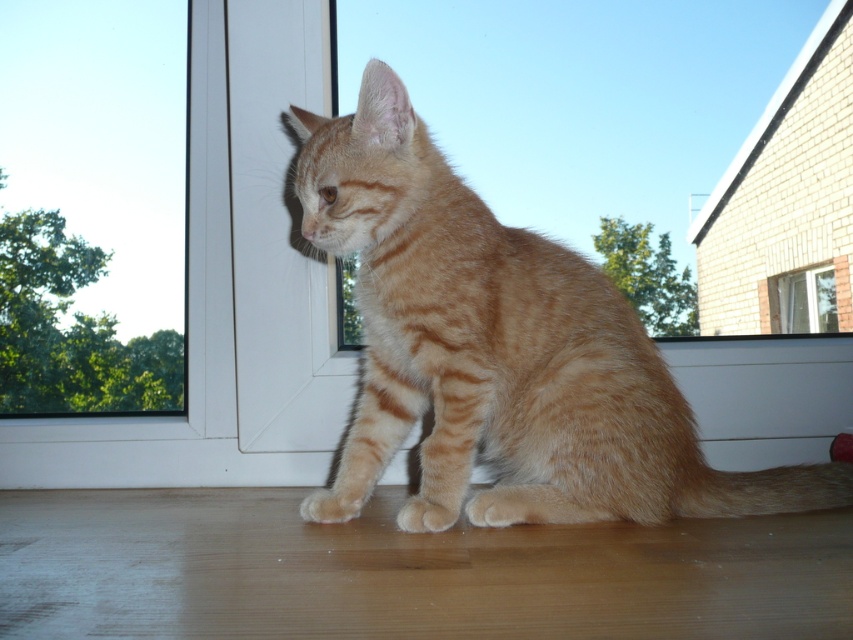
Question: Is orange tabby cat at center thinner than transparent glass window at upper left?

Choices:
 (A) no
 (B) yes

Answer: (A)

Question: Which object appears closest to the camera in this image?

Choices:
 (A) transparent glass window at upper left
 (B) transparent glass window at upper right

Answer: (A)

Question: Which object is farther from the camera taking this photo?

Choices:
 (A) orange tabby cat at center
 (B) transparent glass window at upper left

Answer: (B)

Question: Can you confirm if orange tabby cat at center is positioned to the right of transparent glass window at upper right?

Choices:
 (A) yes
 (B) no

Answer: (B)

Question: In this image, where is orange tabby cat at center located relative to transparent glass window at upper left?

Choices:
 (A) below
 (B) above

Answer: (A)

Question: Which is farther from the orange tabby cat at center?

Choices:
 (A) transparent glass window at upper right
 (B) transparent glass window at upper left

Answer: (A)